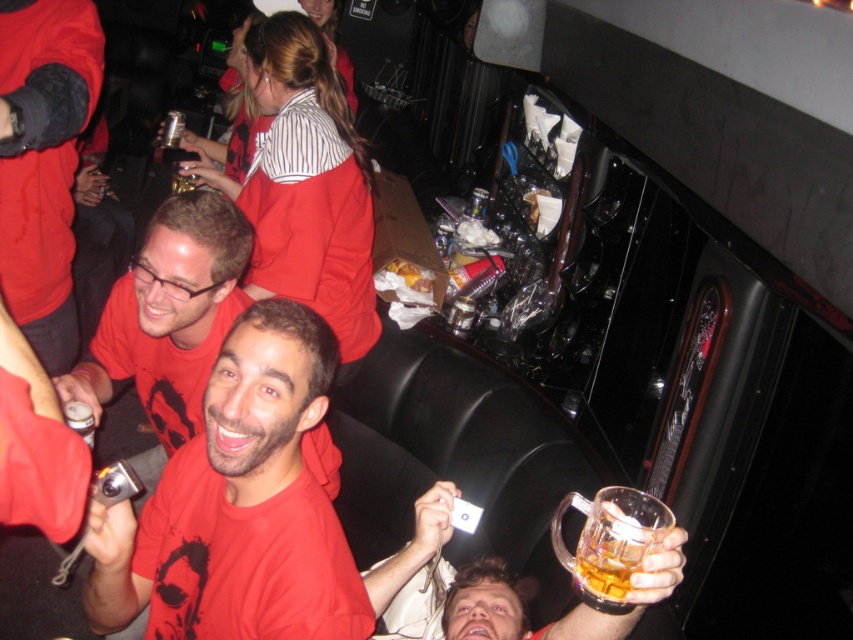
You are at a social gathering and want to take a photo of both the point at coordinates point (578,544) and point (91,412). Which point should you focus on first to ensure both are in focus?

You should focus on point (578,544) first because it is closer to the viewer than point (91,412), ensuring both are within the depth of field.